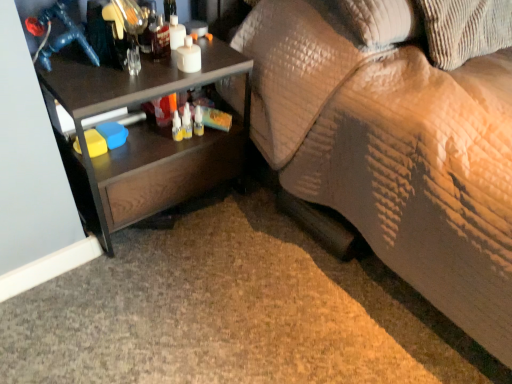
Question: Considering the relative positions of brown corduroy pillow at upper right and dark wood desk at left in the image provided, is brown corduroy pillow at upper right to the left or to the right of dark wood desk at left?

Choices:
 (A) right
 (B) left

Answer: (A)

Question: Considering the positions of brown corduroy pillow at upper right and dark wood desk at left in the image, is brown corduroy pillow at upper right taller or shorter than dark wood desk at left?

Choices:
 (A) short
 (B) tall

Answer: (A)

Question: Estimate the real-world distances between objects in this image. Which object is closer to the textured beige couch at lower right?

Choices:
 (A) dark wood desk at left
 (B) brown corduroy pillow at upper right

Answer: (B)

Question: Which object is the closest to the brown corduroy pillow at upper right?

Choices:
 (A) textured beige couch at lower right
 (B) dark wood desk at left

Answer: (A)